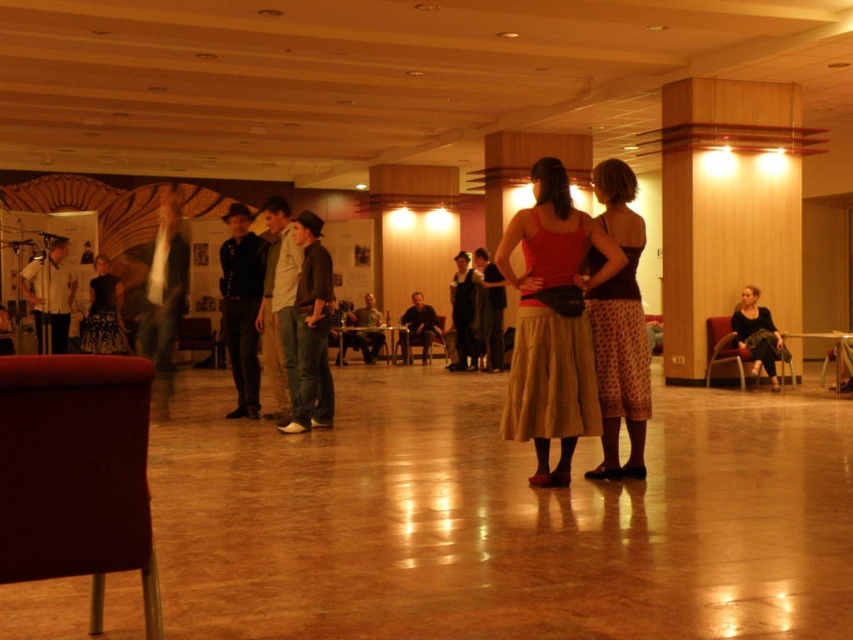
Based on the photo, you are a photographer setting up for an event in the dance studio. You need to position a camera on a tripod to capture both the matte black dress at center and the matte black jacket at center without any overlap. Given their positions, which object should you ensure has more space to its left to avoid blocking the other?

The matte black dress at center might be wider than the matte black jacket at center, so you should ensure the matte black dress at center has more space to its left to avoid blocking the jacket.

You are standing at the entrance of the dance studio and want to find the matte black dress at center. According to the coordinates provided, in which direction should you look to locate it?

The matte black dress at center is located at coordinates point [103,314], which is near the center of the image. Since 0.491 is close to 0.5 on the x axis, and 0.122 is closer to the top on the y axis, you should look towards the center top area of the image to find the matte black dress at center.